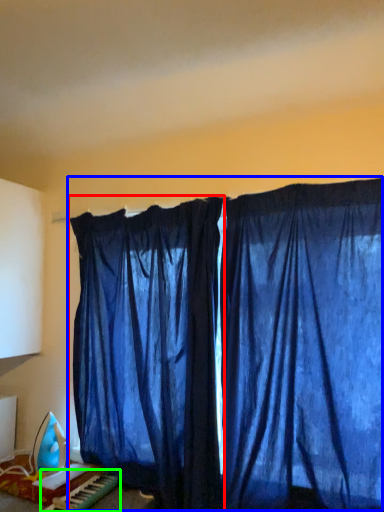
Question: Based on their relative distances, which object is nearer to curtain (highlighted by a red box)? Choose from curtain (highlighted by a blue box) and musical keyboard (highlighted by a green box).

Choices:
 (A) curtain
 (B) musical keyboard

Answer: (A)